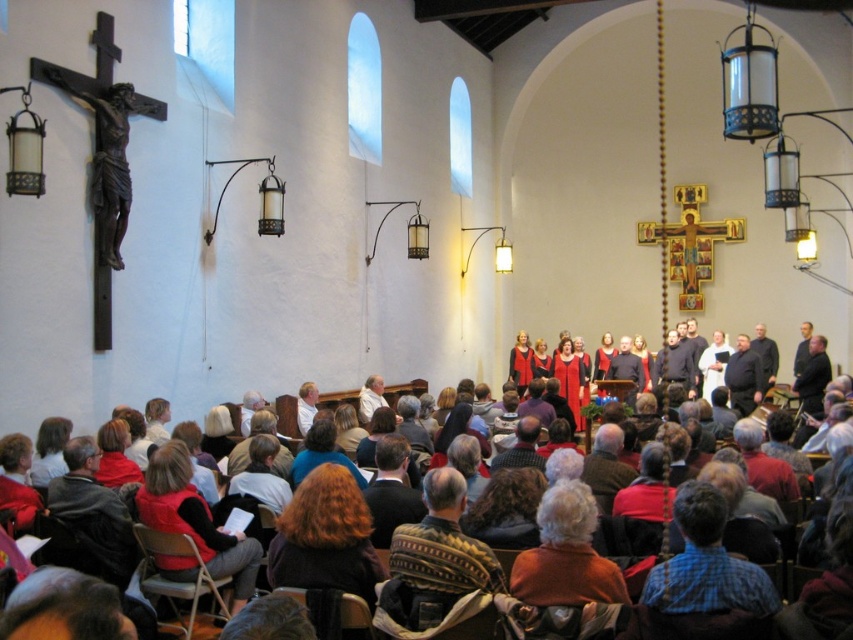
Can you confirm if wooden crucifix at left is thinner than red velvet dress at center?

Indeed, wooden crucifix at left has a lesser width compared to red velvet dress at center.

Can you confirm if wooden crucifix at left is wider than red velvet dress at center?

Incorrect, wooden crucifix at left's width does not surpass red velvet dress at center's.

Find the location of a particular element. The width and height of the screenshot is (853, 640). wooden crucifix at left is located at coordinates (109, 161).